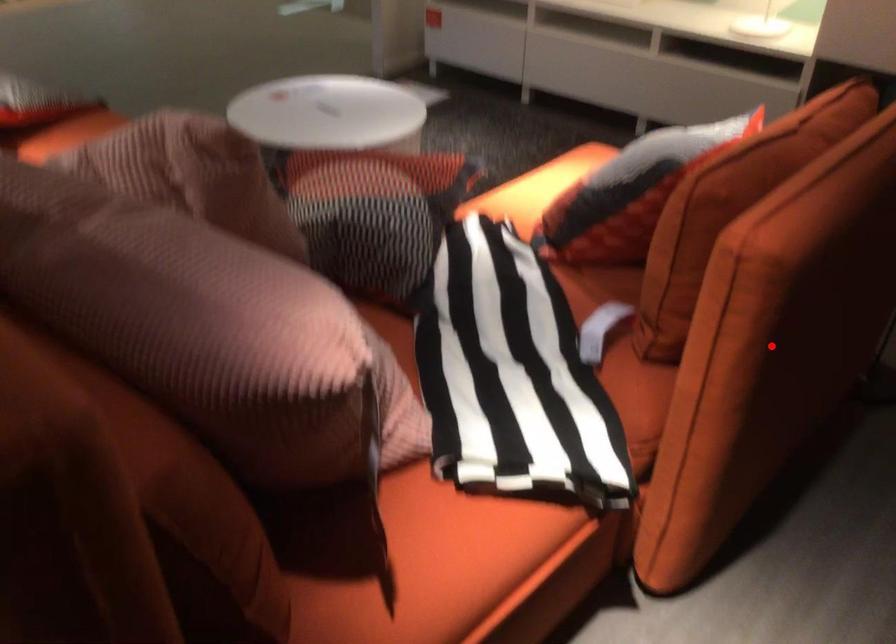
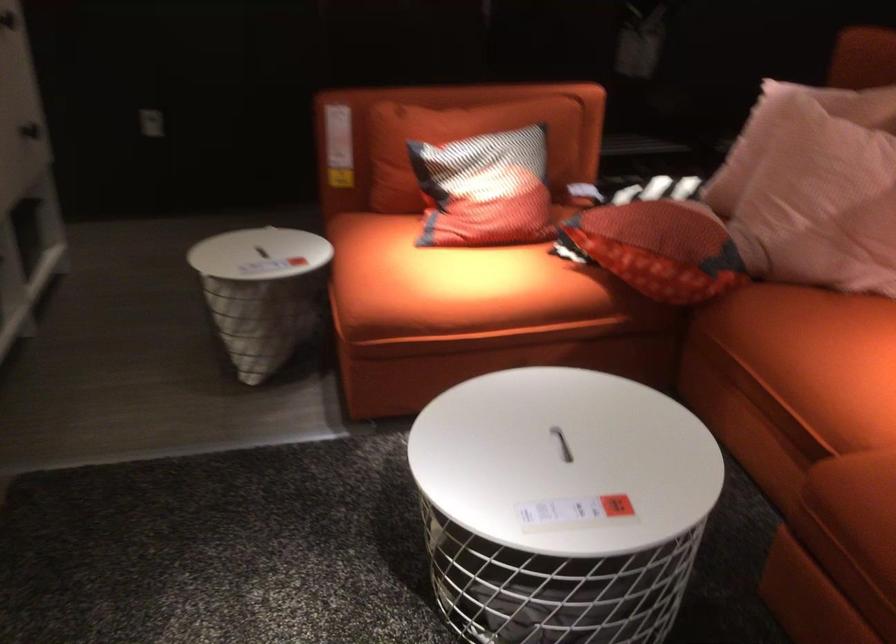
Question: I am providing you with two images of the same scene from different viewpoints. A red point is marked on the first image. At the location where the point appears in image 1, is it still visible in image 2?

Choices:
 (A) Yes
 (B) No

Answer: (B)